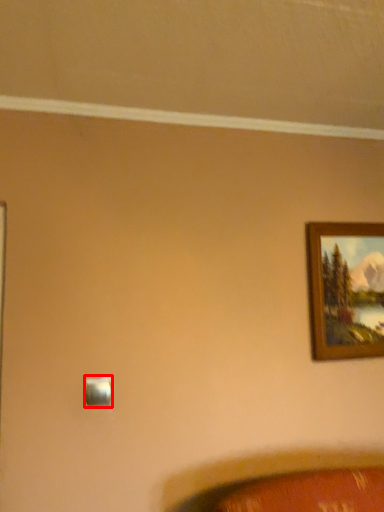
Question: Observing the image, what is the correct spatial positioning of light switch (annotated by the red box) in reference to picture frame?

Choices:
 (A) right
 (B) left

Answer: (B)